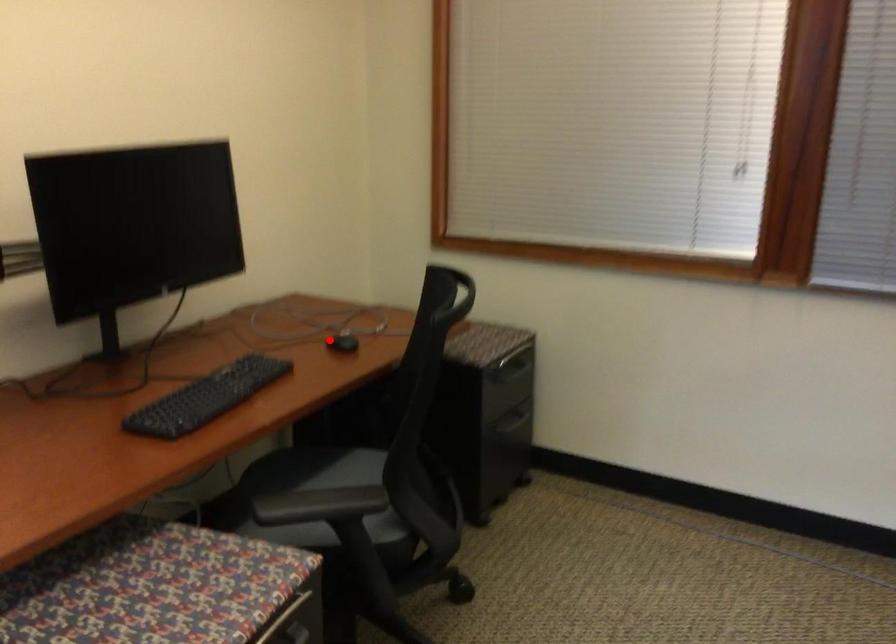
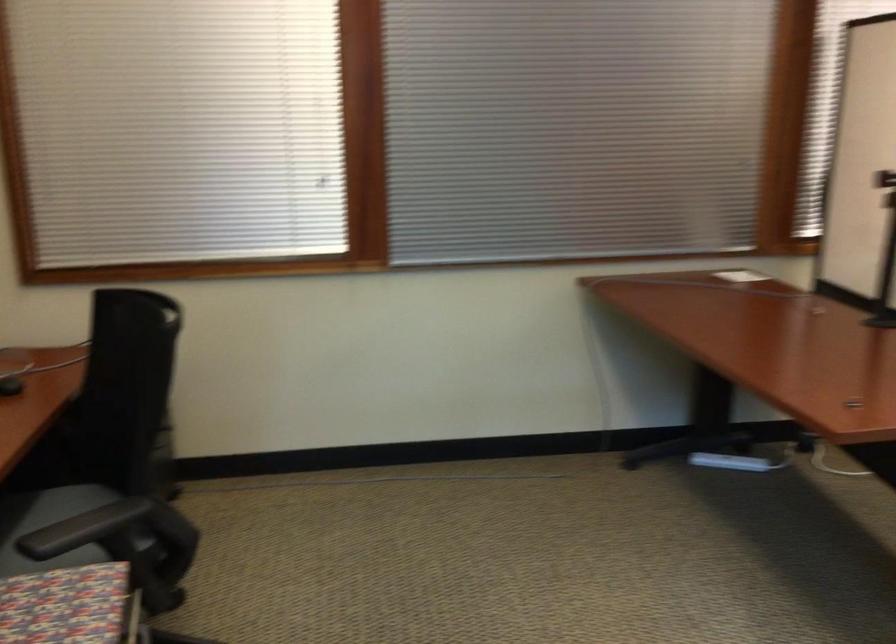
Question: A red point is marked in image1. In image2, is the corresponding 3D point closer to the camera or farther? Reply with the corresponding letter.

Choices:
 (A) The corresponding 3D point is closer.
 (B) The corresponding 3D point is farther.

Answer: (A)